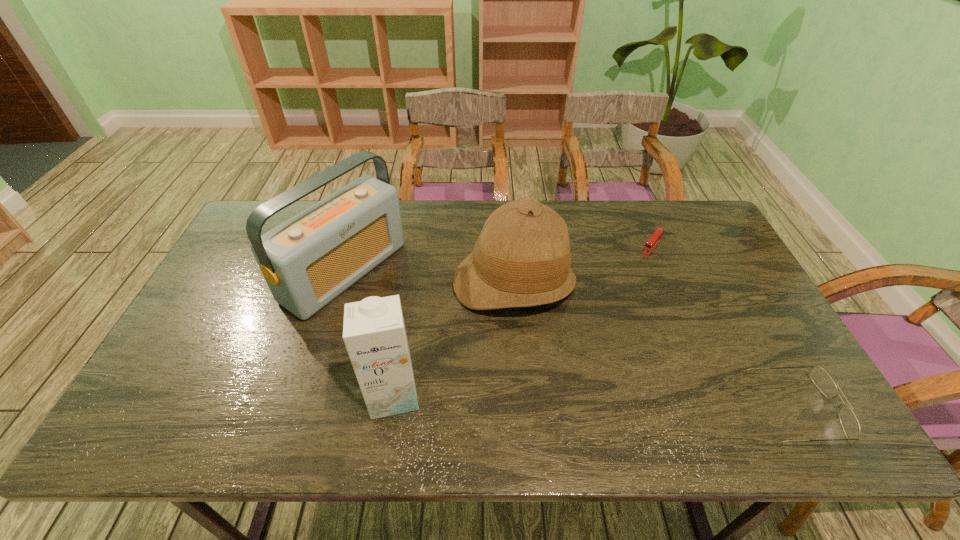
Locate an element on the screen. vacant point that satisfies the following two spatial constraints: 1. on the front side of the third object from left to right; 2. on the front-facing side of the second shortest object is located at coordinates (524, 408).

At what (x,y) coordinates should I click in order to perform the action: click on vacant space that satisfies the following two spatial constraints: 1. on the front side of the fourth tallest object; 2. on the front-facing side of the carton. Please return your answer as a coordinate pair (x, y). The height and width of the screenshot is (540, 960). Looking at the image, I should click on (x=391, y=408).